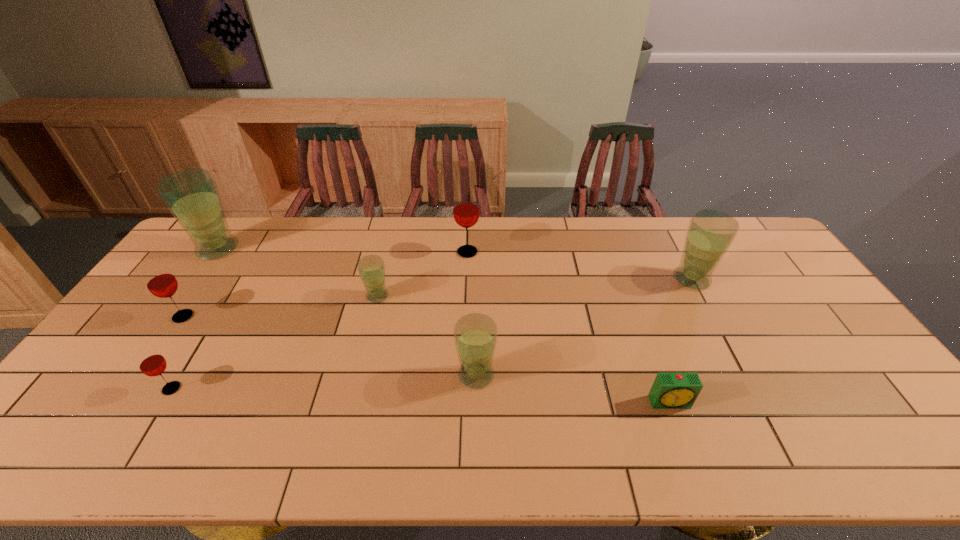
At what (x,y) coordinates should I click in order to perform the action: click on empty location between the seventh object from left to right and the third nearest glass. Please return your answer as a coordinate pair (x, y). The height and width of the screenshot is (540, 960). Looking at the image, I should click on (426, 360).

Identify the location of vacant space that's between the rightmost object and the leftmost red glass. pos(438,298).

You are a GUI agent. You are given a task and a screenshot of the screen. Output one action in this format:
    pyautogui.click(x=<x>, y=<y>)
    Task: Click on the free spot between the fourth nearest object and the nearest blue glass
    The width and height of the screenshot is (960, 540).
    Given the screenshot: What is the action you would take?
    pyautogui.click(x=329, y=346)

This screenshot has width=960, height=540. Find the location of `free spot between the tallest object and the fourth glass from right to left`. free spot between the tallest object and the fourth glass from right to left is located at coordinates (298, 273).

Locate an element on the screen. The width and height of the screenshot is (960, 540). free point between the nearest red glass and the second smallest blue glass is located at coordinates (324, 382).

I want to click on empty space between the fourth nearest object and the seventh object from left to right, so click(x=426, y=360).

Find the location of `free point between the third biggest blue glass and the smallest blue glass`. free point between the third biggest blue glass and the smallest blue glass is located at coordinates (426, 336).

At what (x,y) coordinates should I click in order to perform the action: click on free space that is in between the smallest red glass and the third blue glass from left to right. Please return your answer as a coordinate pair (x, y). The height and width of the screenshot is (540, 960). Looking at the image, I should click on (324, 382).

Find the location of a particular element. Image resolution: width=960 pixels, height=540 pixels. unoccupied area between the nearest red glass and the rightmost red glass is located at coordinates (320, 320).

You are a GUI agent. You are given a task and a screenshot of the screen. Output one action in this format:
    pyautogui.click(x=<x>, y=<y>)
    Task: Click on the vacant space that is in between the tallest object and the nearest blue glass
    
    Given the screenshot: What is the action you would take?
    pyautogui.click(x=347, y=312)